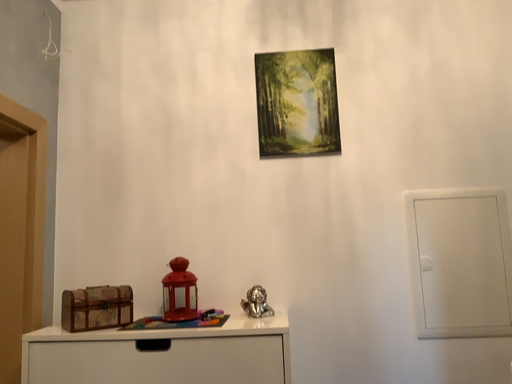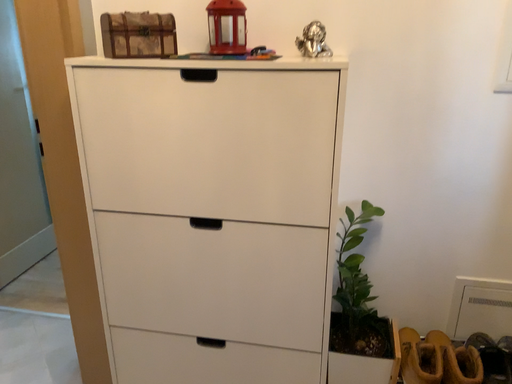
Question: How did the camera likely rotate when shooting the video?

Choices:
 (A) rotated downward
 (B) rotated upward

Answer: (A)